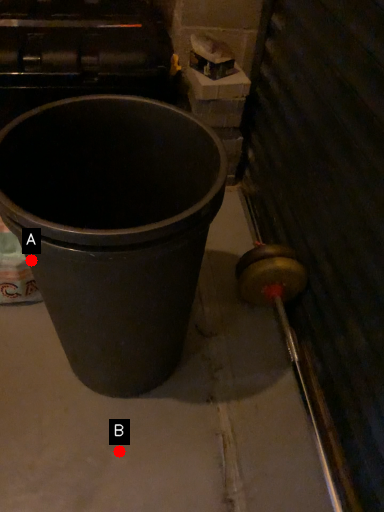
Question: Two points are circled on the image, labeled by A and B beside each circle. Which point is farther from the camera taking this photo?

Choices:
 (A) A is further
 (B) B is further

Answer: (B)